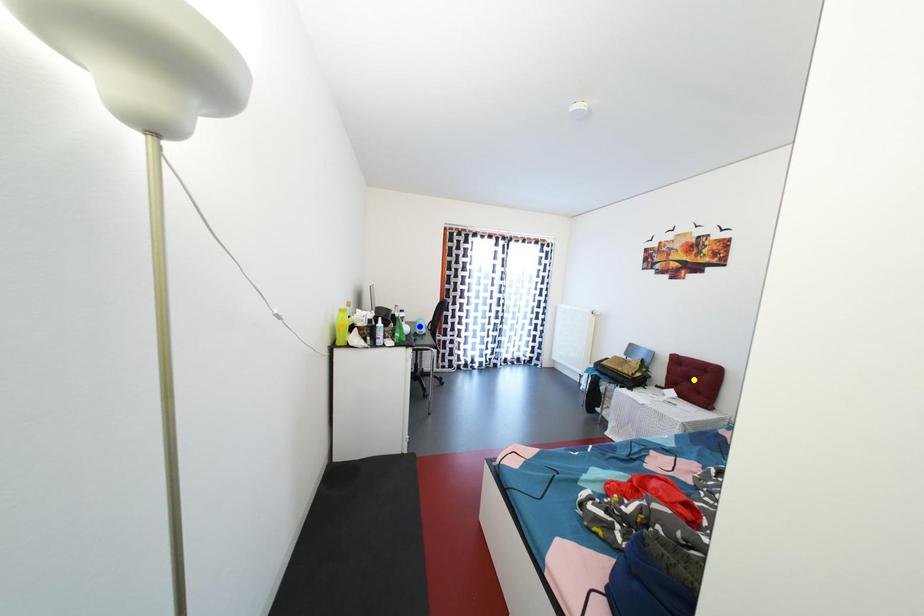
Order these from farthest to nearest:
blue point, orange point, yellow point

blue point, yellow point, orange point